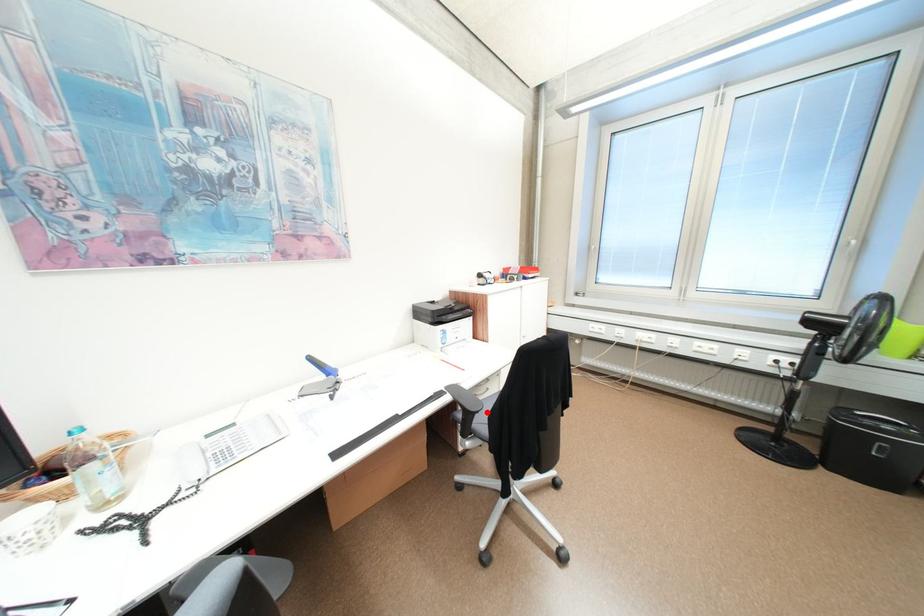
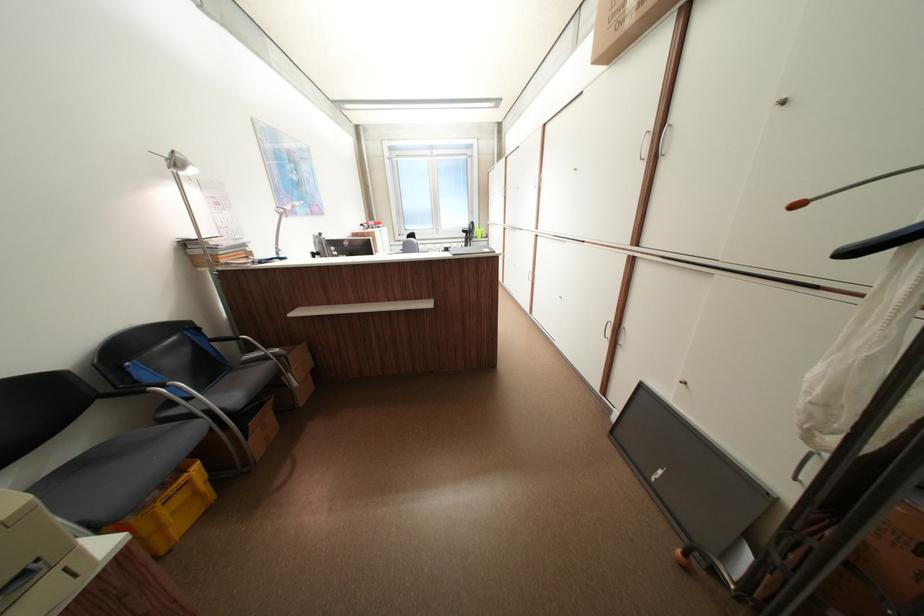
Locate, in the second image, the point that corresponds to the highlighted location in the first image.

(409, 254)